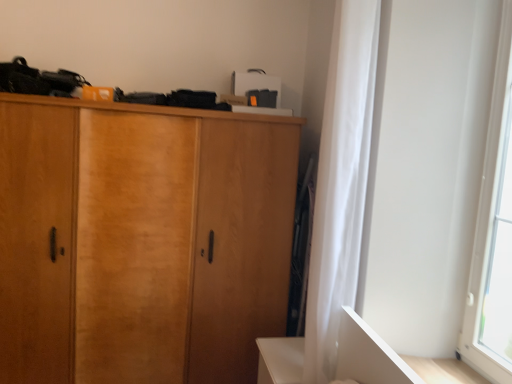
Question: Considering the positions of point (471, 314) and point (348, 289), is point (471, 314) closer or farther from the camera than point (348, 289)?

Choices:
 (A) closer
 (B) farther

Answer: (A)

Question: Would you say transparent glass window at right is to the left or to the right of white sheer curtain at right in the picture?

Choices:
 (A) right
 (B) left

Answer: (A)

Question: Estimate the real-world distances between objects in this image. Which object is closer to the transparent glass window at right?

Choices:
 (A) wooden cabinet at center
 (B) white sheer curtain at right

Answer: (B)

Question: Estimate the real-world distances between objects in this image. Which object is farther from the white sheer curtain at right?

Choices:
 (A) wooden cabinet at center
 (B) transparent glass window at right

Answer: (A)